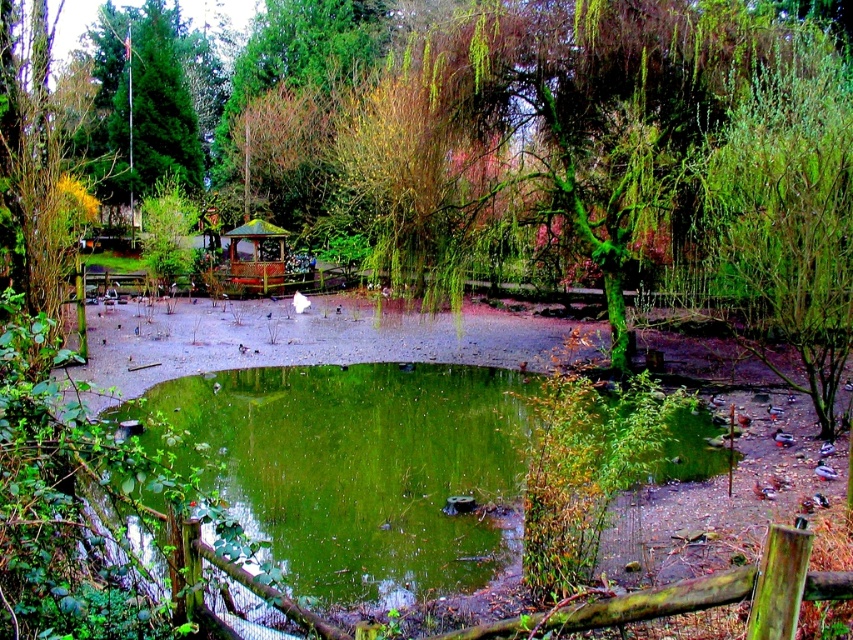
Does green algae-covered pond at center appear on the left side of wooden gazebo at center?

Incorrect, green algae-covered pond at center is not on the left side of wooden gazebo at center.

Is point (344, 480) farther from viewer compared to point (273, 262)?

No, (344, 480) is closer to viewer.

Is point (347, 564) closer to camera compared to point (270, 248)?

Yes, it is.

You are a GUI agent. You are given a task and a screenshot of the screen. Output one action in this format:
    pyautogui.click(x=<x>, y=<y>)
    Task: Click on the green algae-covered pond at center
    The image size is (853, 640).
    Given the screenshot: What is the action you would take?
    pyautogui.click(x=352, y=468)

Does point (88, 67) come farther from viewer compared to point (283, 236)?

Yes, it is.

Does green leafy tree at center have a greater height compared to wooden gazebo at center?

Yes, green leafy tree at center is taller than wooden gazebo at center.

Who is more distant from viewer, [48,109] or [247,253]?

Positioned behind is point [247,253].

Identify the location of green leafy tree at center. The image size is (853, 640). (45, 170).

What do you see at coordinates (352, 468) in the screenshot?
I see `green algae-covered pond at center` at bounding box center [352, 468].

Is point (148, 401) farther from camera compared to point (57, 186)?

Yes, it is behind point (57, 186).

This screenshot has height=640, width=853. Identify the location of green algae-covered pond at center. (352, 468).

At what (x,y) coordinates should I click in order to perform the action: click on green algae-covered pond at center. Please return your answer as a coordinate pair (x, y). Image resolution: width=853 pixels, height=640 pixels. Looking at the image, I should click on (352, 468).